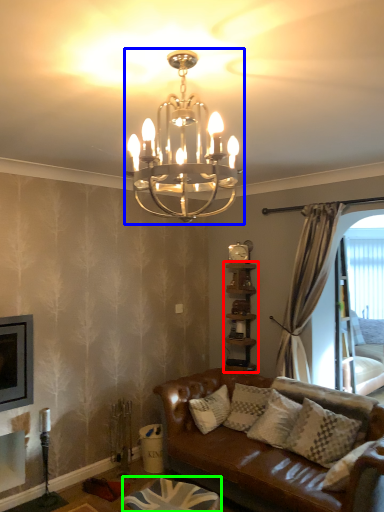
Question: Which object is the farthest from shelf (highlighted by a red box)? Choose among these: lamp (highlighted by a blue box) or footrest (highlighted by a green box).

Choices:
 (A) lamp
 (B) footrest

Answer: (A)